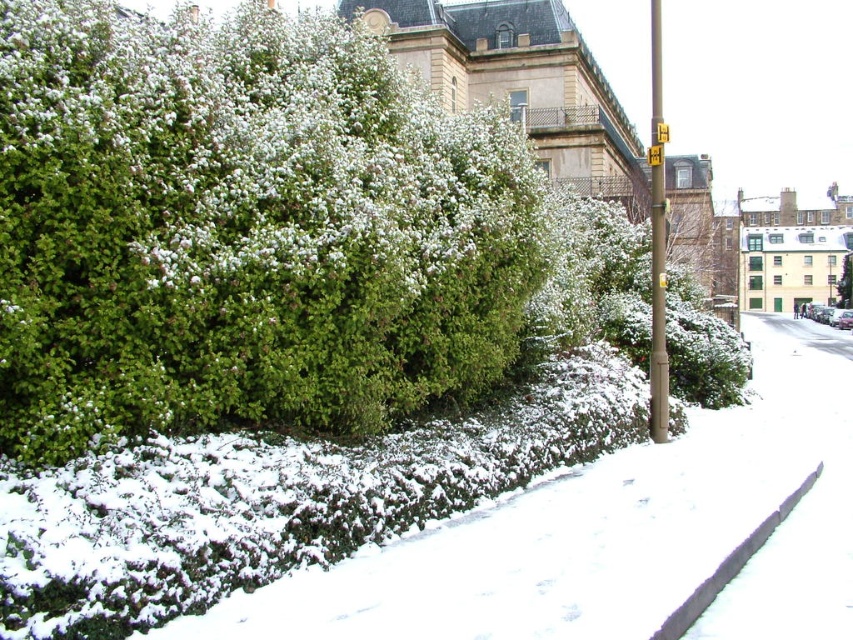
You are standing at the point with coordinates (607, 532) in the snowy urban scene. What is the object located at this point?

The point at coordinates (607, 532) corresponds to green grass at lower left.

You are a delivery person trying to park your 1.2 meter wide cart between the brown metallic pole at right and the black rubber curb at lower right. Can your cart fit through the space between them?

The brown metallic pole at right is wider than the black rubber curb at lower right, but the question is about the space between them. Since the objects description only provides information about their widths, not the distance between them, we cannot determine if the cart can fit. More information about the distance between the pole and curb is needed.

You are a delivery robot that needs to place a package on the black rubber curb at lower right. The package is 1.2 meters wide. Can the package fit on the curb if the curb is narrower than the yellow plastic sign at upper center?

The black rubber curb at lower right is narrower than the yellow plastic sign at upper center. Since the package is 1.2 meters wide, but the curb is narrower than the sign, we need to know the exact width of the curb to determine if it can fit. However, the information provided only states that the curb is narrower than the sign, so we cannot confirm if it can hold the package.